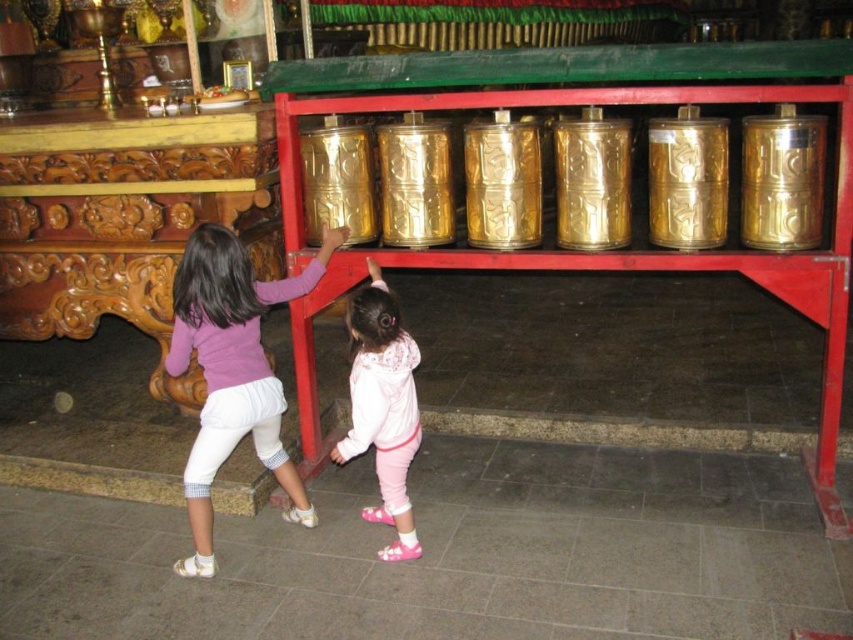
You are a photographer trying to capture a photo of both the purple cotton shirt at lower left and the pink fleece jacket at center. Since you want to ensure both subjects are in focus, you need to know which one is taller. Can you determine which is taller?

The purple cotton shirt at lower left is taller than the pink fleece jacket at center, so you should focus on the taller one first to ensure both are in focus.